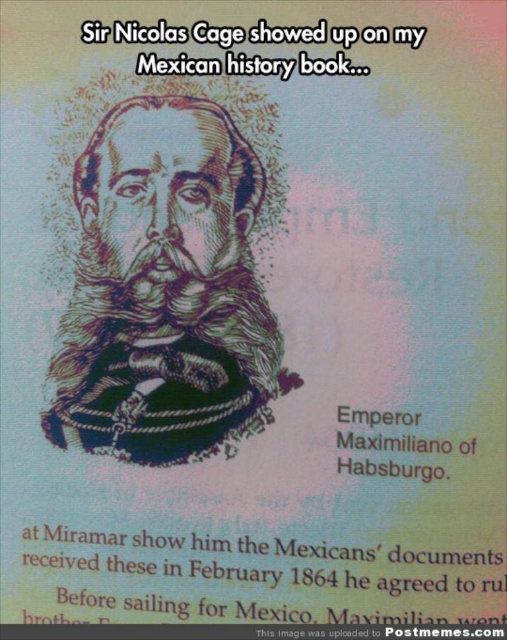
You are looking at a meme image featuring Emperor Maximiliano of Habsburgo. The image has two text elements. The first is a white paper text at upper center, and the second is a black paper text at center. Which of these text elements has a greater width?

The white paper text at upper center has a greater width than the black paper text at center according to the description.